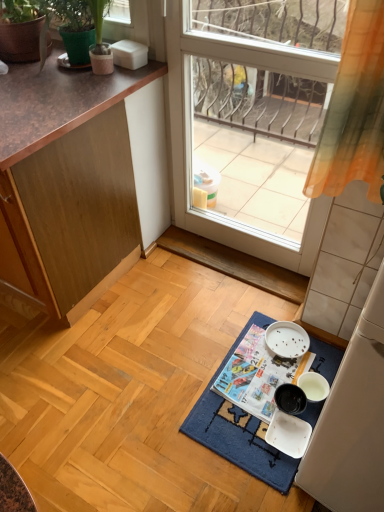
The image size is (384, 512). What are the coordinates of `free space in front of printed paper magazine at center` in the screenshot? It's located at (248, 443).